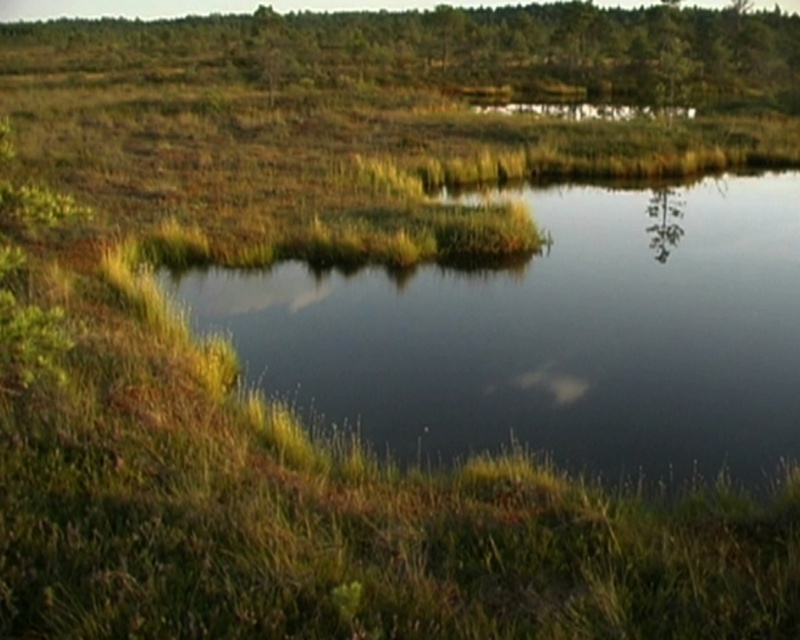
Is green grassy lake at center above green matte tree at upper center?

No, green grassy lake at center is not above green matte tree at upper center.

Is green grassy lake at center bigger than green matte tree at upper center?

Actually, green grassy lake at center might be smaller than green matte tree at upper center.

Image resolution: width=800 pixels, height=640 pixels. In order to click on green grassy lake at center in this screenshot , I will do `click(552, 333)`.